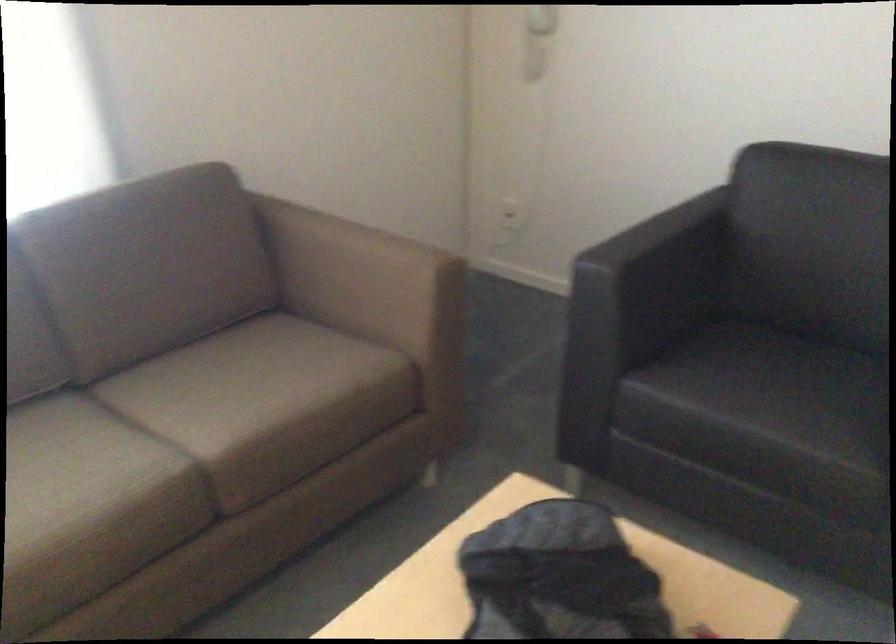
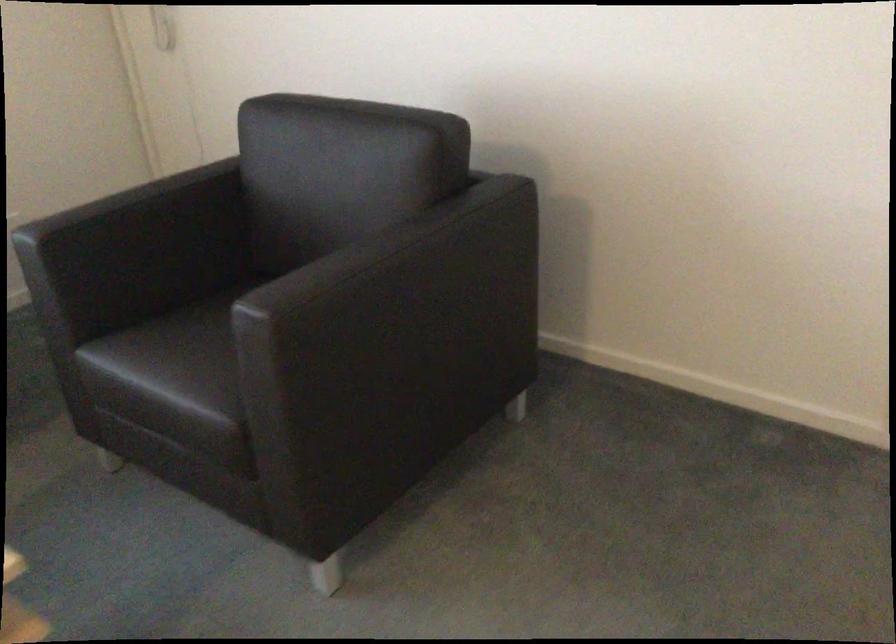
The point at (670, 258) is marked in the first image. Where is the corresponding point in the second image?

(147, 225)